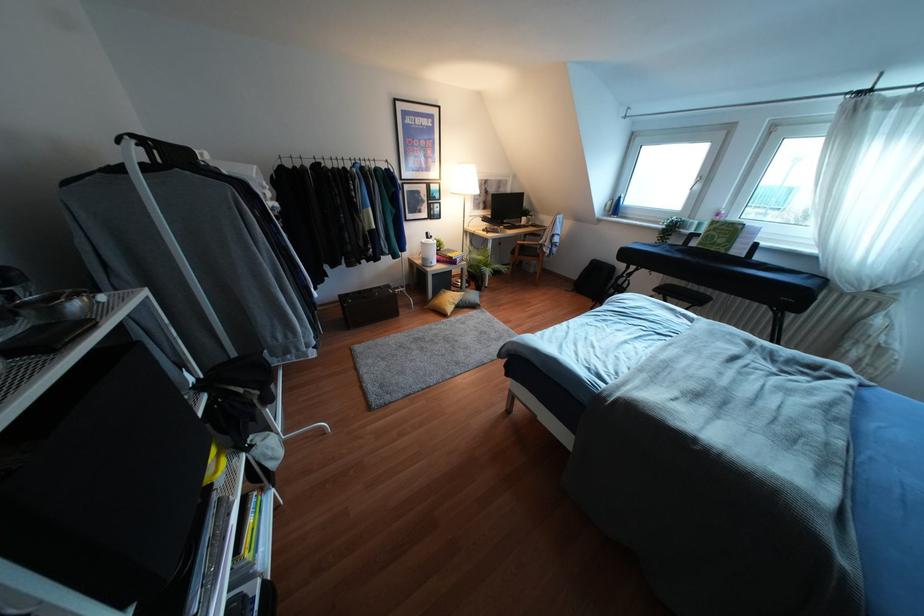
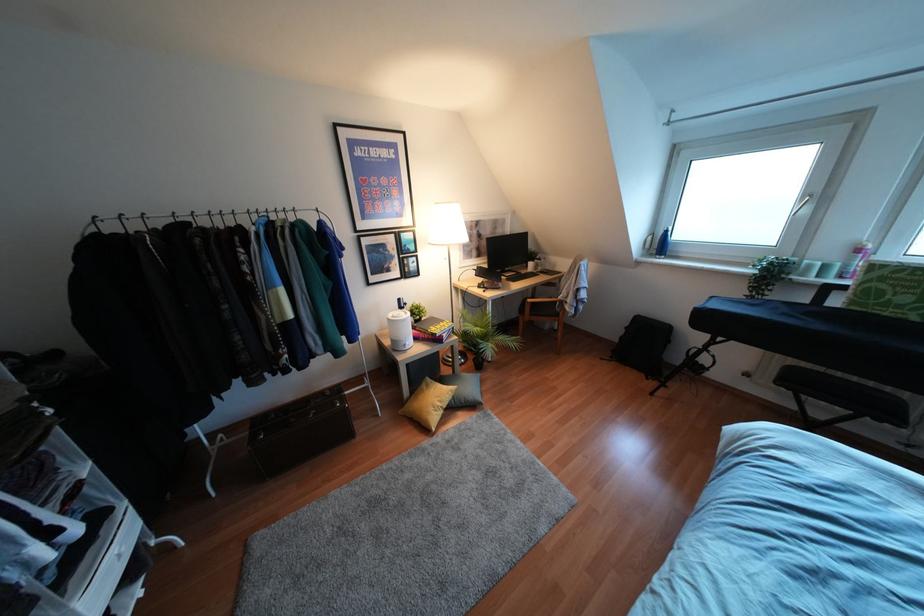
Question: What movement of the cameraman would produce the second image?

Choices:
 (A) Left
 (B) Right
 (C) Forward
 (D) Backward

Answer: (C)